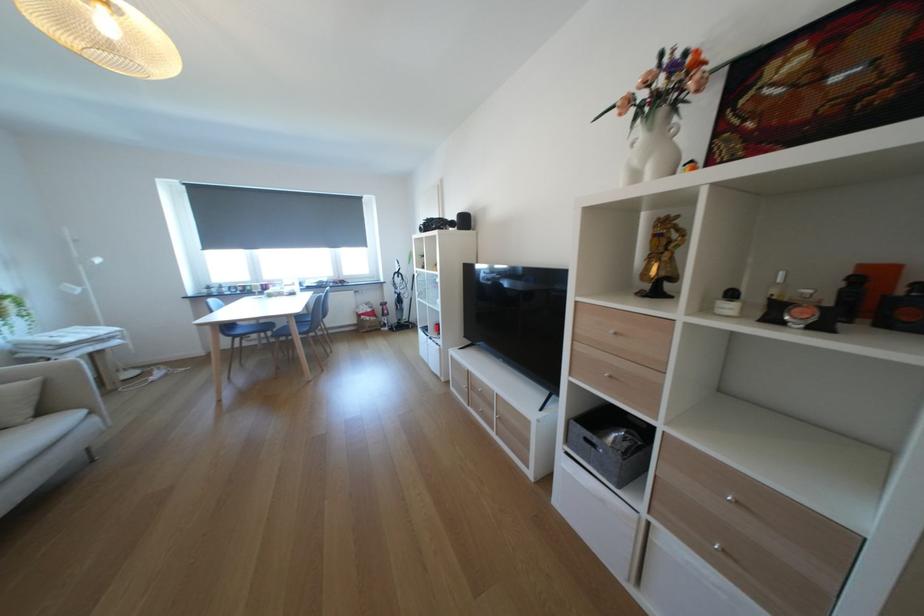
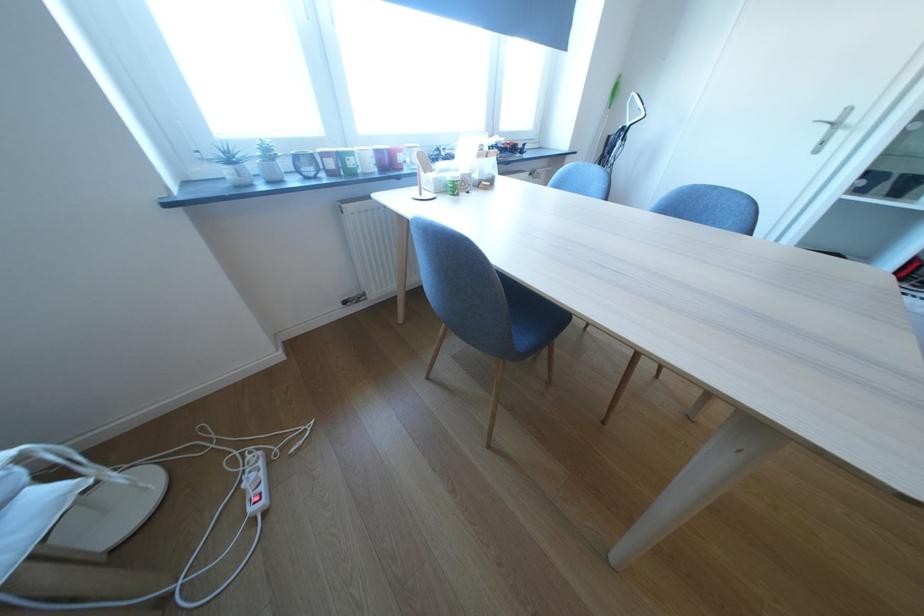
Where in the second image is the point corresponding to point (260, 290) from the first image?

(361, 164)